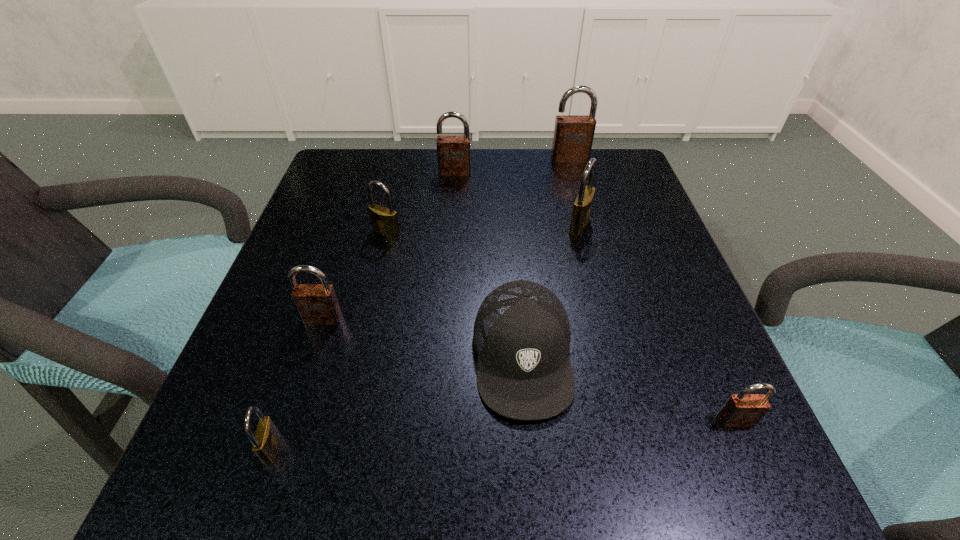
Identify the location of the biggest brown padlock. (573, 136).

This screenshot has width=960, height=540. I want to click on the farthest brown padlock, so click(573, 136).

This screenshot has height=540, width=960. In order to click on the rightmost brass padlock in this screenshot , I will do `click(582, 206)`.

Locate an element on the screen. the fourth object from left to right is located at coordinates (453, 152).

Where is `the second biggest brown padlock`? This screenshot has height=540, width=960. the second biggest brown padlock is located at coordinates (453, 152).

Find the location of a particular element. Image resolution: width=960 pixels, height=540 pixels. the second brass padlock from left to right is located at coordinates (384, 221).

Identify the location of the second smallest brass padlock. (384, 221).

This screenshot has height=540, width=960. In order to click on the second nearest brown padlock in this screenshot , I will do `click(317, 304)`.

Locate an element on the screen. the fifth farthest padlock is located at coordinates (317, 304).

At what (x,y) coordinates should I click in order to perform the action: click on cap. Please return your answer as a coordinate pair (x, y). This screenshot has width=960, height=540. Looking at the image, I should click on (521, 335).